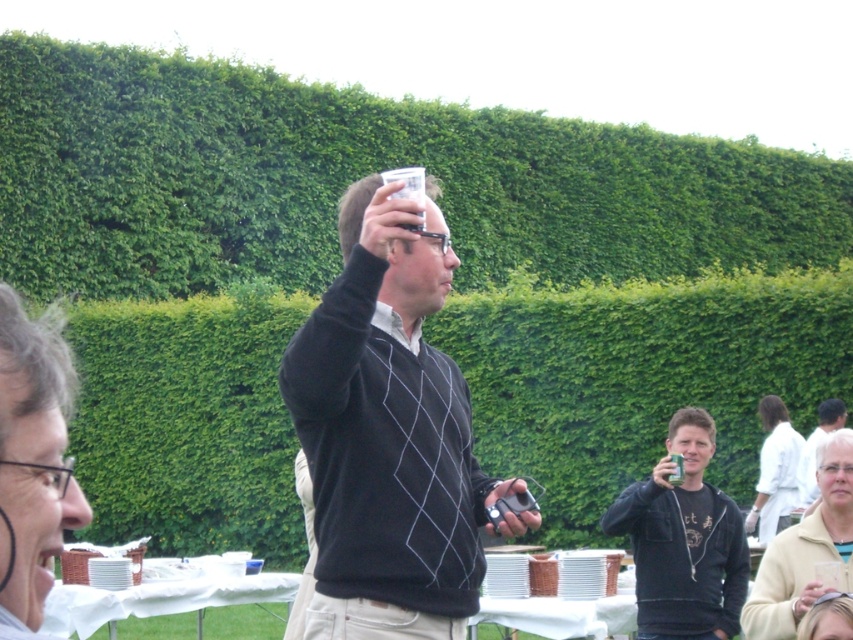
Is point (680, 636) positioned before point (813, 566)?

No, (680, 636) is further to viewer.

Between black matte shirt at center and khaki sweater at lower right, which one is positioned lower?

khaki sweater at lower right is below.

Where is `black matte shirt at center`? This screenshot has height=640, width=853. black matte shirt at center is located at coordinates (683, 541).

Can you confirm if matte black sweater at upper center is taller than black matte shirt at center?

Correct, matte black sweater at upper center is much taller as black matte shirt at center.

Between point (73, 380) and point (718, 588), which one is positioned behind?

The point (718, 588) is behind.

I want to click on matte black sweater at upper center, so click(x=32, y=464).

Is black matte shirt at center further to the viewer compared to white textured shirt at lower right?

No, black matte shirt at center is closer to the viewer.

Looking at this image, between black matte shirt at center and white textured shirt at lower right, which one has less height?

white textured shirt at lower right

What do you see at coordinates (683, 541) in the screenshot? The width and height of the screenshot is (853, 640). I see `black matte shirt at center` at bounding box center [683, 541].

Identify the location of black matte shirt at center. Image resolution: width=853 pixels, height=640 pixels. (683, 541).